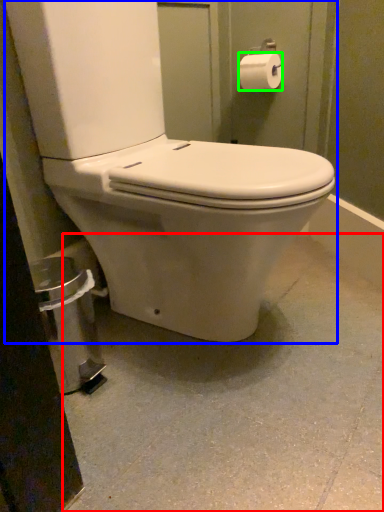
Question: Estimate the real-world distances between objects in this image. Which object is closer to concrete (highlighted by a red box), toilet (highlighted by a blue box) or toilet paper (highlighted by a green box)?

Choices:
 (A) toilet
 (B) toilet paper

Answer: (A)